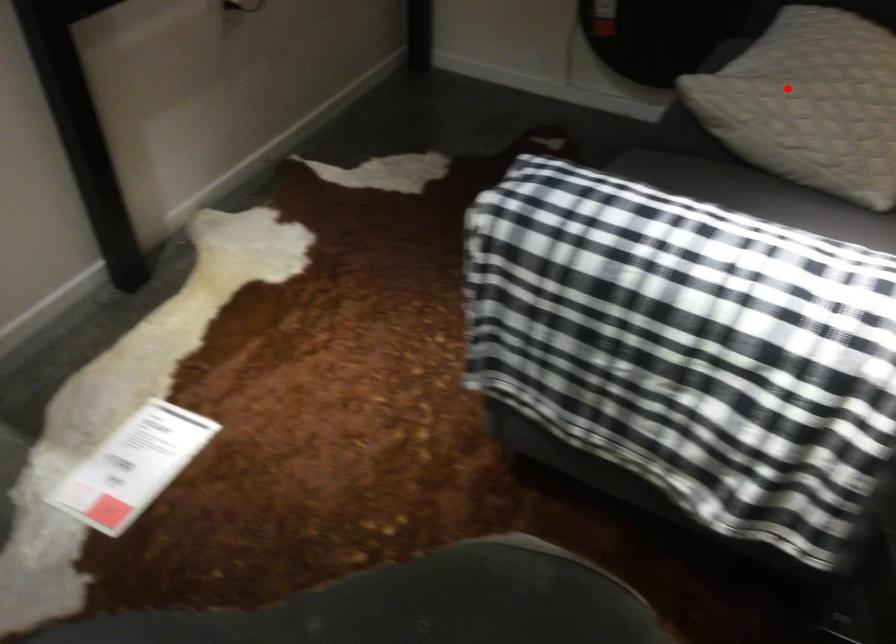
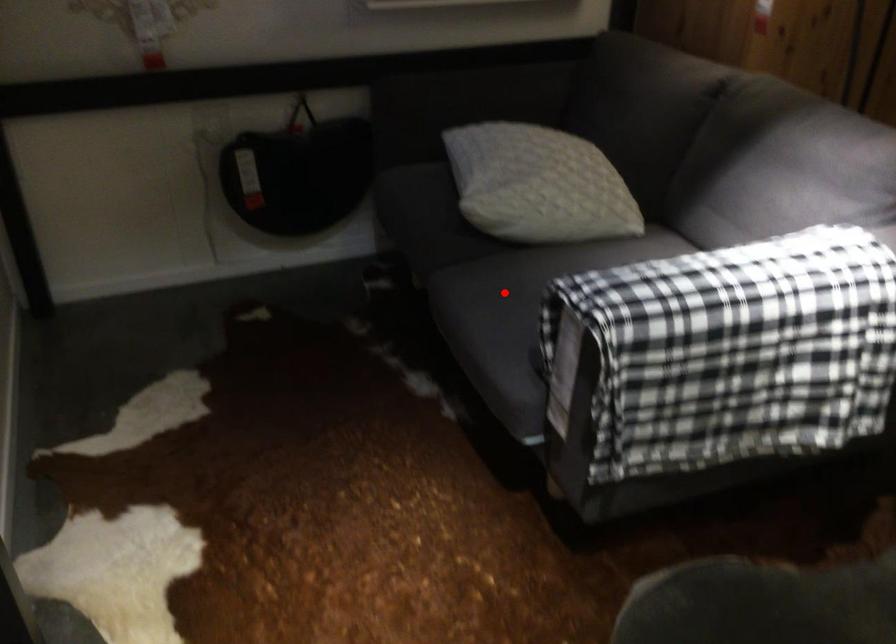
I am providing you with two images of the same scene from different viewpoints. A red point is marked on the first image and another point is marked on the second image. Does the point marked in image1 correspond to the same location as the one in image2?

No